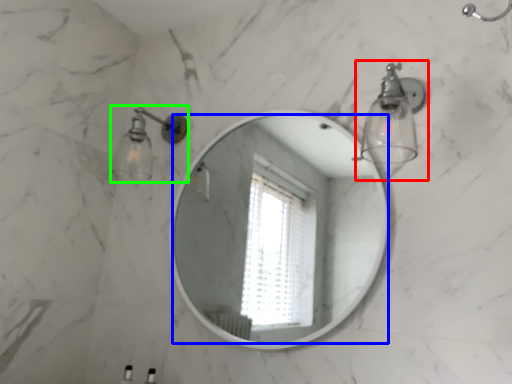
Question: Considering the real-world distances, which object is farthest from light fixture (highlighted by a red box)? mirror (highlighted by a blue box) or light fixture (highlighted by a green box)?

Choices:
 (A) mirror
 (B) light fixture

Answer: (A)